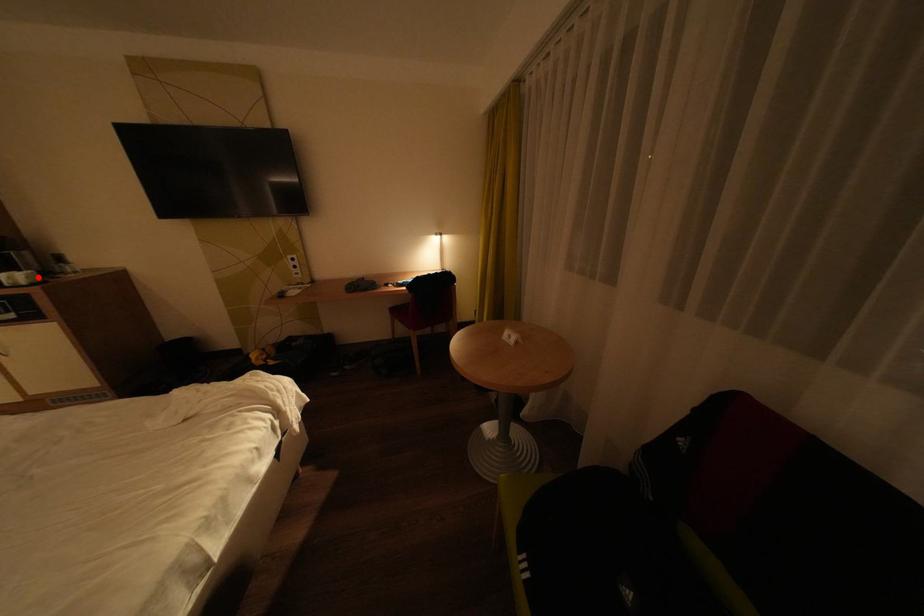
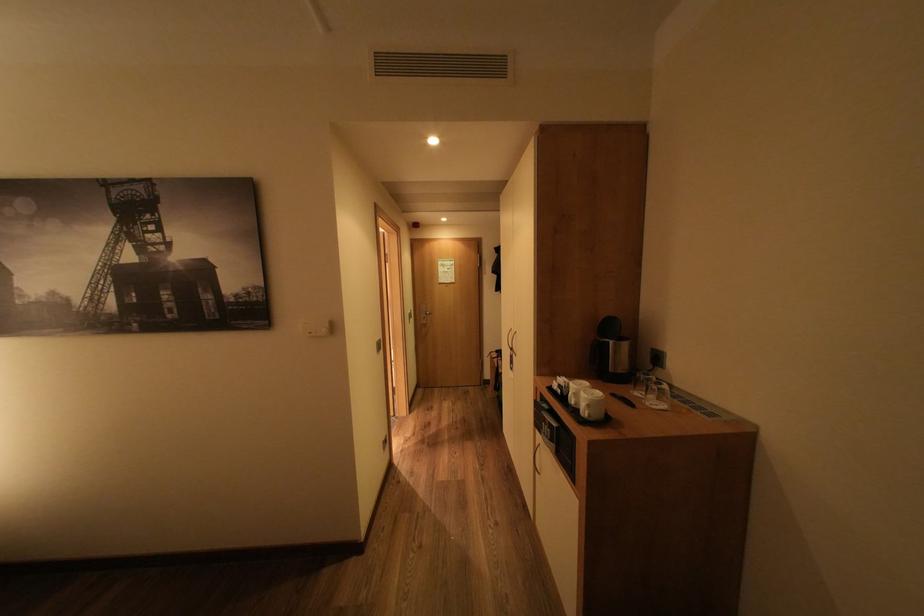
In the second image, find the point that corresponds to the highlighted location in the first image.

(600, 406)